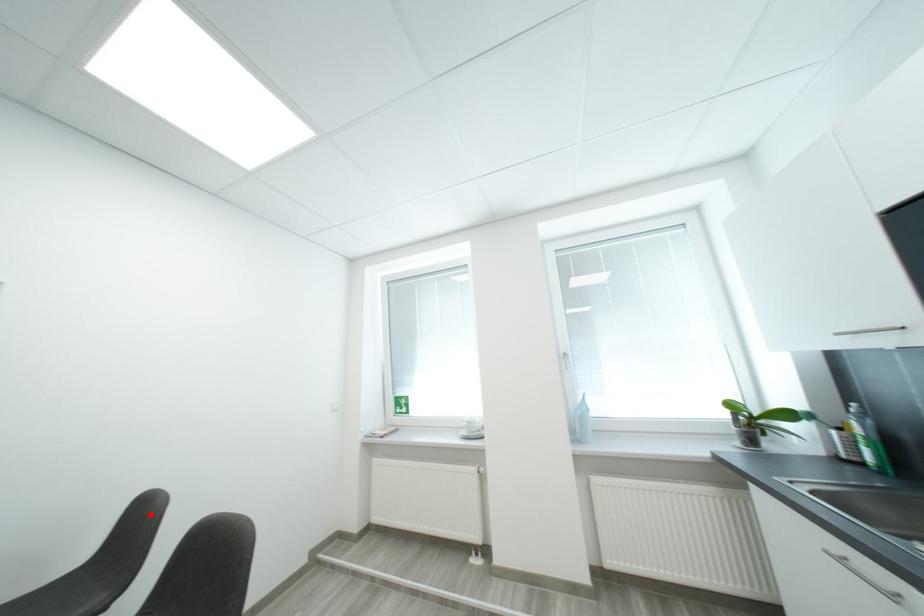
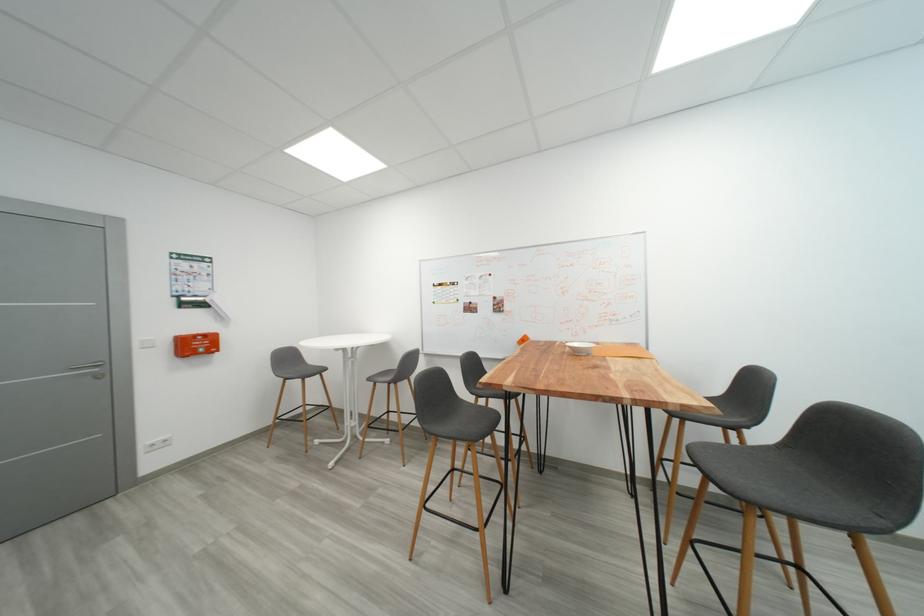
Question: I am providing you with two images of the same scene from different viewpoints. Image1 has a red point marked. In image2, the corresponding 3D location appears at what relative position? Reply with the corresponding letter.

Choices:
 (A) Closer
 (B) Farther

Answer: (B)